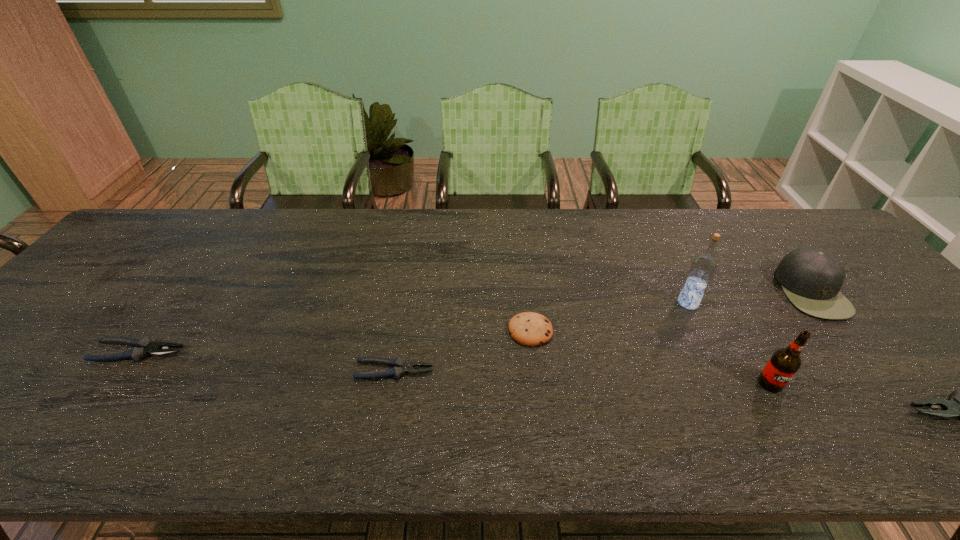
At what (x,y) coordinates should I click in order to perform the action: click on spot to insert another pliers for uniform distribution. Please return your answer as a coordinate pair (x, y). This screenshot has width=960, height=540. Looking at the image, I should click on (670, 390).